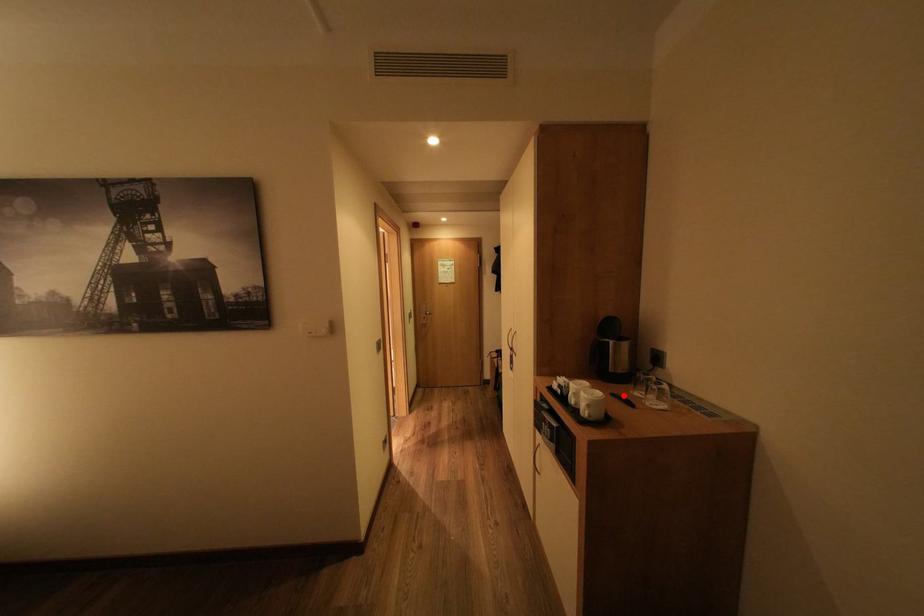
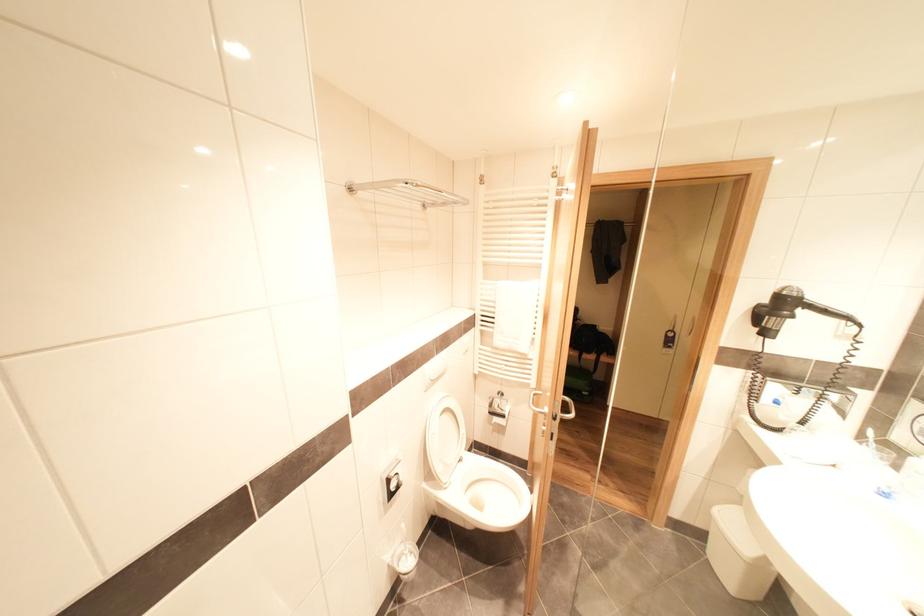
Question: I am providing you with two images of the same scene from different viewpoints. A red point is marked on the first image. Is the red point's position out of view in image 2?

Choices:
 (A) Yes
 (B) No

Answer: (A)